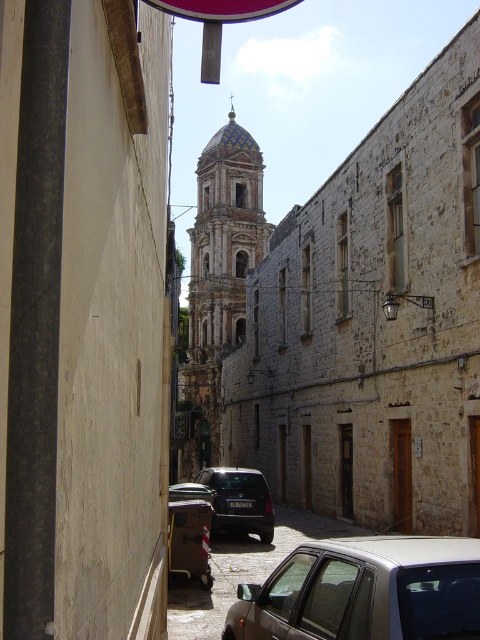
Question: In this image, where is golden mosaic dome at center located relative to dark gray matte car at center?

Choices:
 (A) below
 (B) above

Answer: (B)

Question: Is silver metallic car at lower center smaller than dark gray matte car at center?

Choices:
 (A) yes
 (B) no

Answer: (B)

Question: Is stone tower at center further to camera compared to golden mosaic dome at center?

Choices:
 (A) yes
 (B) no

Answer: (B)

Question: Which point is closer to the camera taking this photo?

Choices:
 (A) (398, 621)
 (B) (218, 19)

Answer: (A)

Question: Which of the following is the closest to the observer?

Choices:
 (A) metallic car at center
 (B) golden mosaic dome at center

Answer: (A)

Question: Which is nearer to the metallic circular sign at upper center?

Choices:
 (A) golden mosaic dome at center
 (B) metallic car at center
 (C) silver metallic car at lower center
 (D) dark gray matte car at center

Answer: (C)